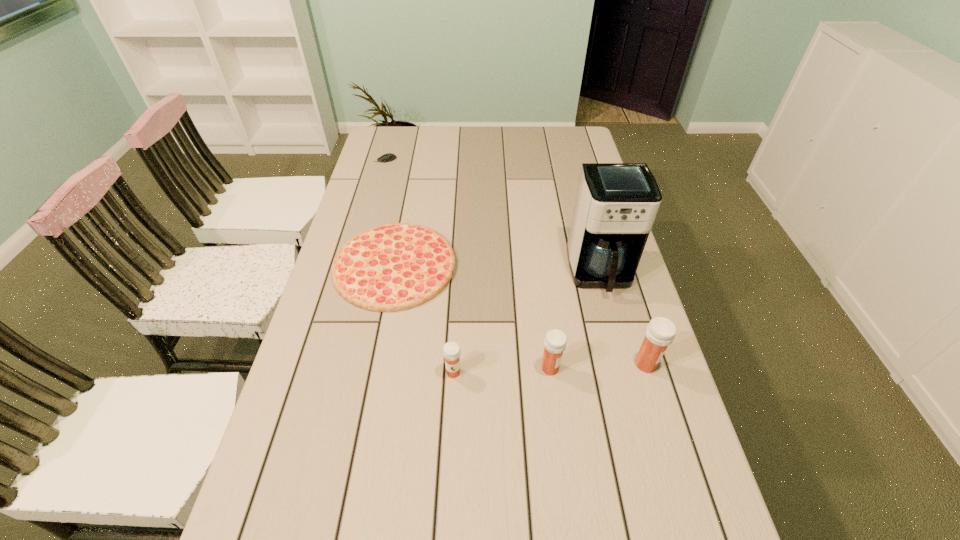
The medicines are evenly distributed in the image. To maintain this, where would you place another medicine on the left? Please point to a free space. Please provide its 2D coordinates. Your answer should be formatted as a tuple, i.e. [(x, y)], where the tuple contains the x and y coordinates of a point satisfying the conditions above.

[(355, 376)]